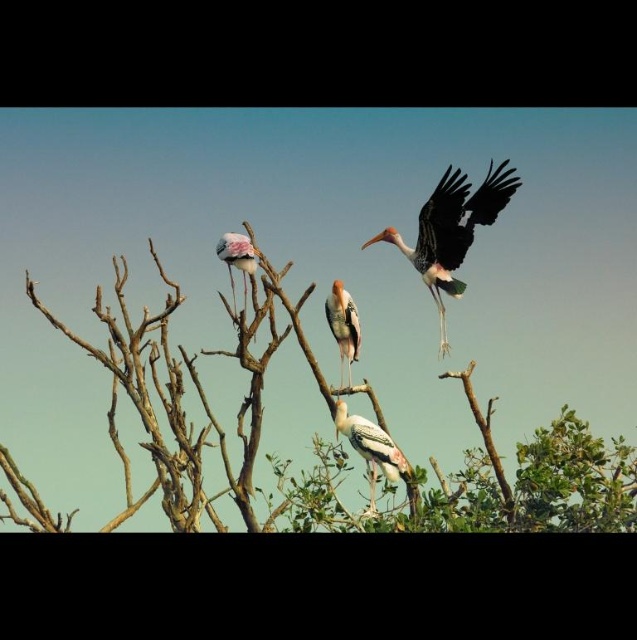
Who is taller, multicolored feathered bird at upper right or white feathered bird at upper center?

Standing taller between the two is multicolored feathered bird at upper right.

Is multicolored feathered bird at upper right shorter than white feathered bird at upper center?

No.

At what (x,y) coordinates should I click in order to perform the action: click on multicolored feathered bird at upper right. Please return your answer as a coordinate pair (x, y). The width and height of the screenshot is (637, 640). Looking at the image, I should click on (450, 230).

Is multicolored feathered bird at upper right further to the viewer compared to painted wood stork at center?

No, it is in front of painted wood stork at center.

Which is below, multicolored feathered bird at upper right or painted wood stork at center?

Positioned lower is painted wood stork at center.

Does point (447, 224) come closer to viewer compared to point (352, 332)?

Yes, point (447, 224) is closer to viewer.

At what (x,y) coordinates should I click in order to perform the action: click on multicolored feathered bird at upper right. Please return your answer as a coordinate pair (x, y). The height and width of the screenshot is (640, 637). Looking at the image, I should click on (450, 230).

Is painted wood stork at center shorter than white feathered bird at upper center?

No, painted wood stork at center is not shorter than white feathered bird at upper center.

I want to click on painted wood stork at center, so click(x=343, y=324).